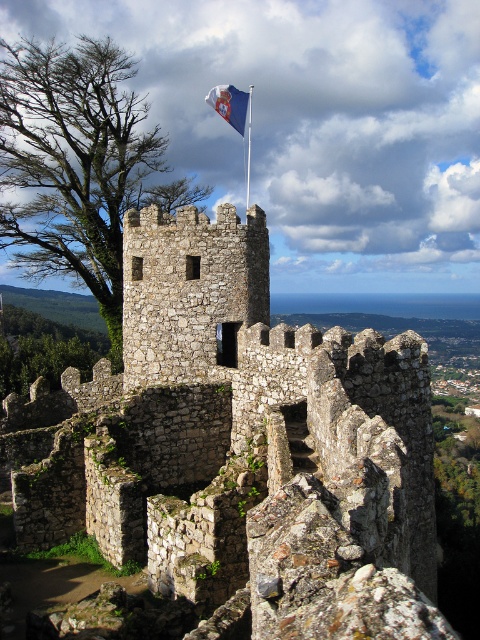
You are a medieval knight standing at the base of the stone structure. You want to climb to the top to retrieve the blue fabric flag at upper center. The stone wall at center is blocking your path. Can you go around it to reach the flag?

The stone wall at center is in front of the blue fabric flag at upper center, so you can go around the stone wall at center to reach the blue fabric flag at upper center.